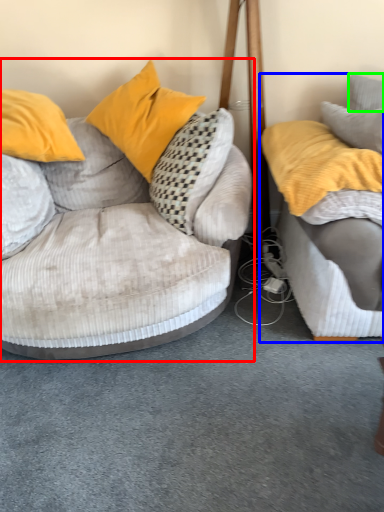
Question: Considering the real-world distances, which object is closest to studio couch (highlighted by a red box)? studio couch (highlighted by a blue box) or pillow (highlighted by a green box).

Choices:
 (A) studio couch
 (B) pillow

Answer: (A)